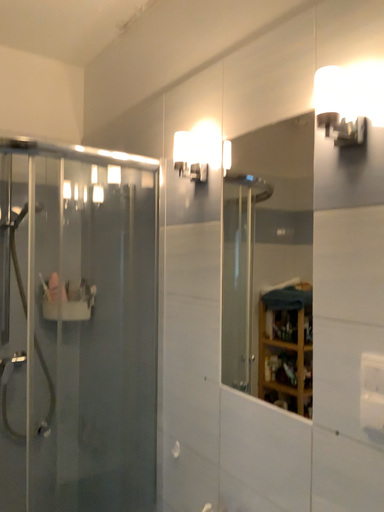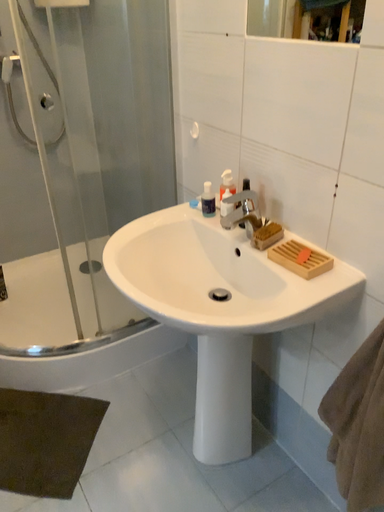
Question: How did the camera likely rotate when shooting the video?

Choices:
 (A) rotated downward
 (B) rotated upward

Answer: (A)